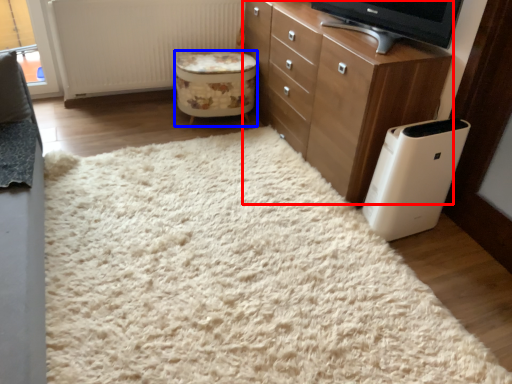
Question: Which object is closer to the camera taking this photo, chest of drawers (highlighted by a red box) or stool (highlighted by a blue box)?

Choices:
 (A) chest of drawers
 (B) stool

Answer: (A)